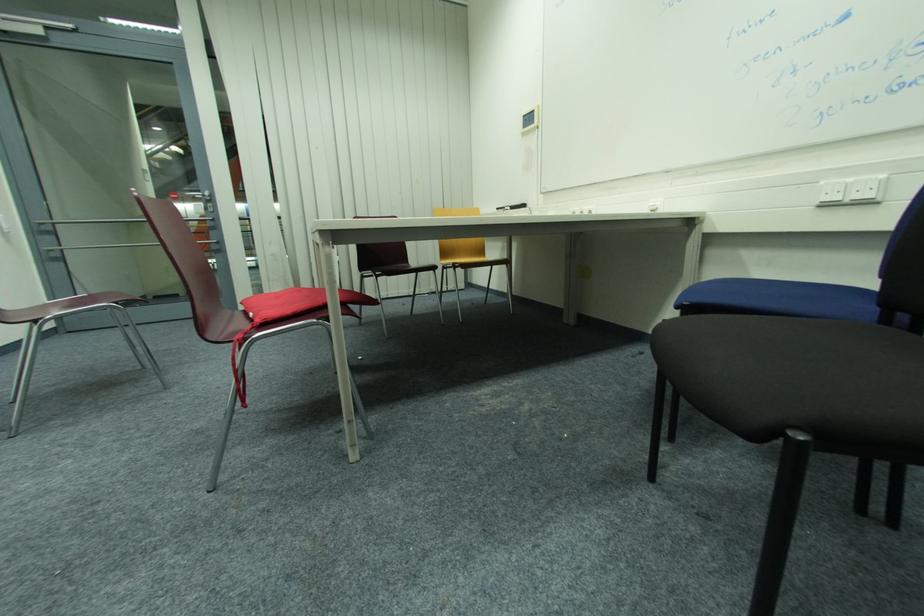
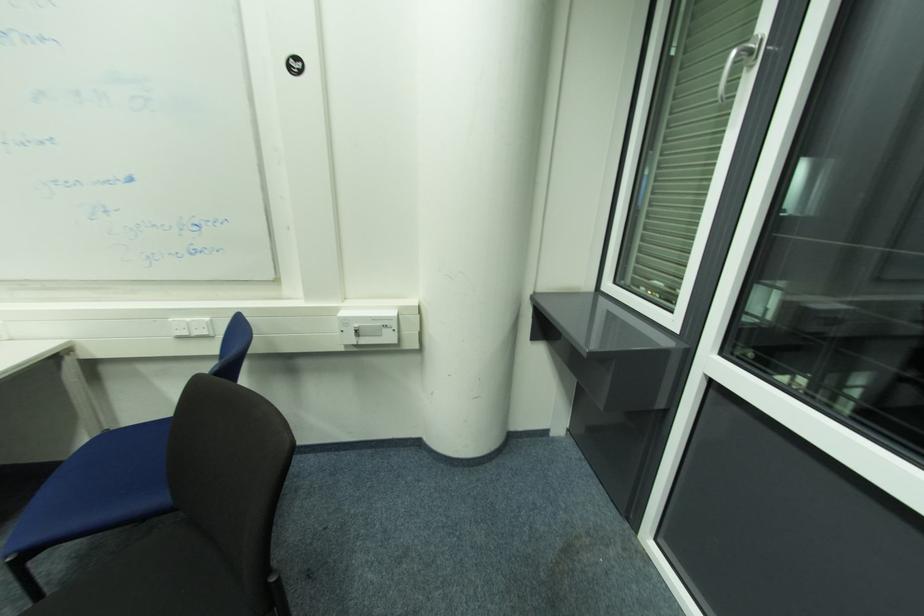
Question: The images are taken continuously from a first-person perspective. In which direction is your viewpoint rotating?

Choices:
 (A) Left
 (B) Right
 (C) Up
 (D) Down

Answer: (B)